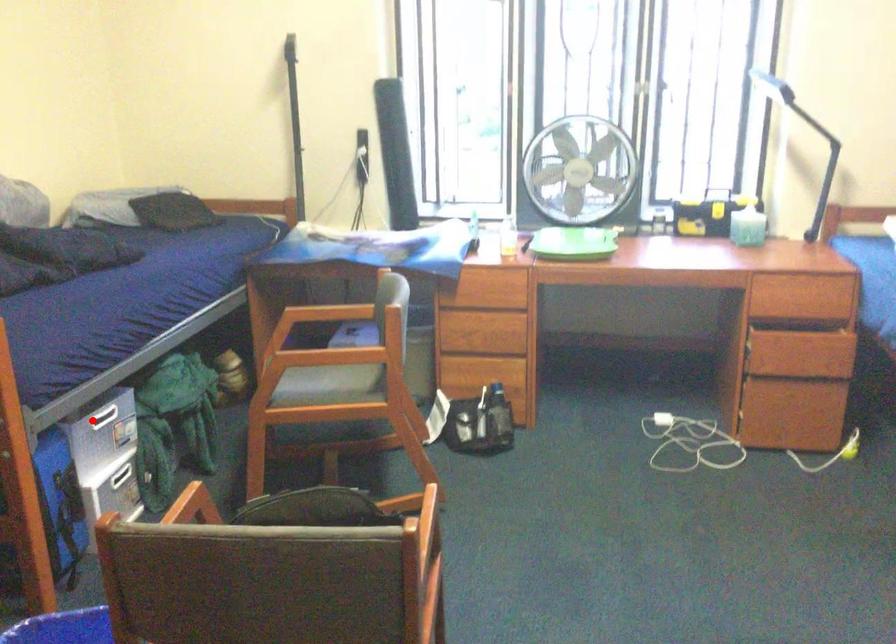
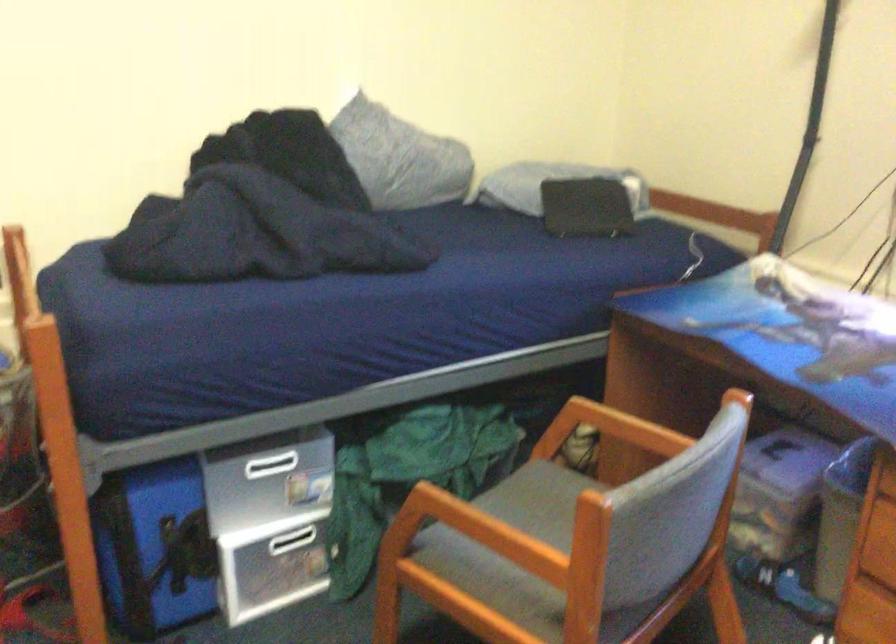
Locate, in the second image, the point that corresponds to the highlighted location in the first image.

(270, 465)